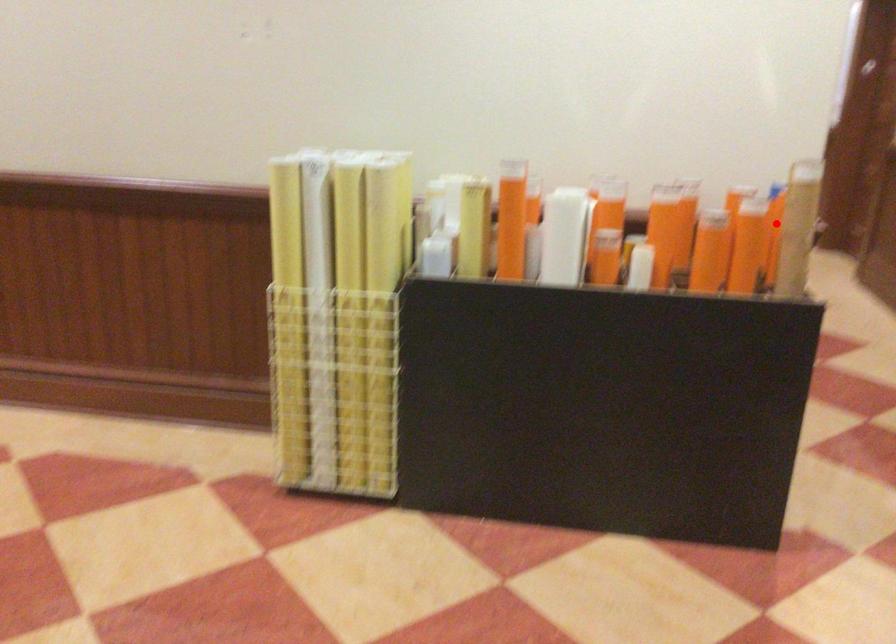
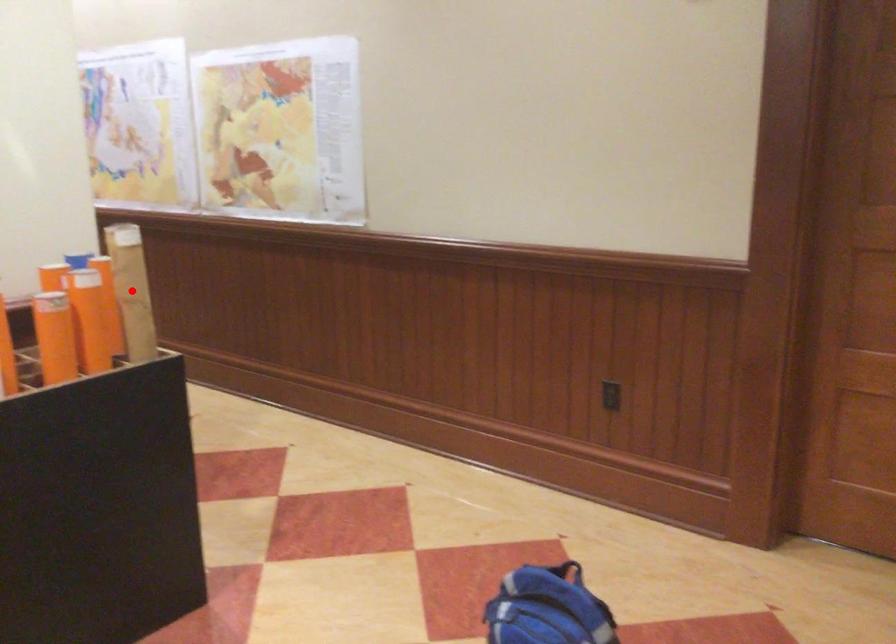
I am providing you with two images of the same scene from different viewpoints. A red point is marked on the first image and another point is marked on the second image. Is the marked point in image1 the same physical position as the marked point in image2?

Yes